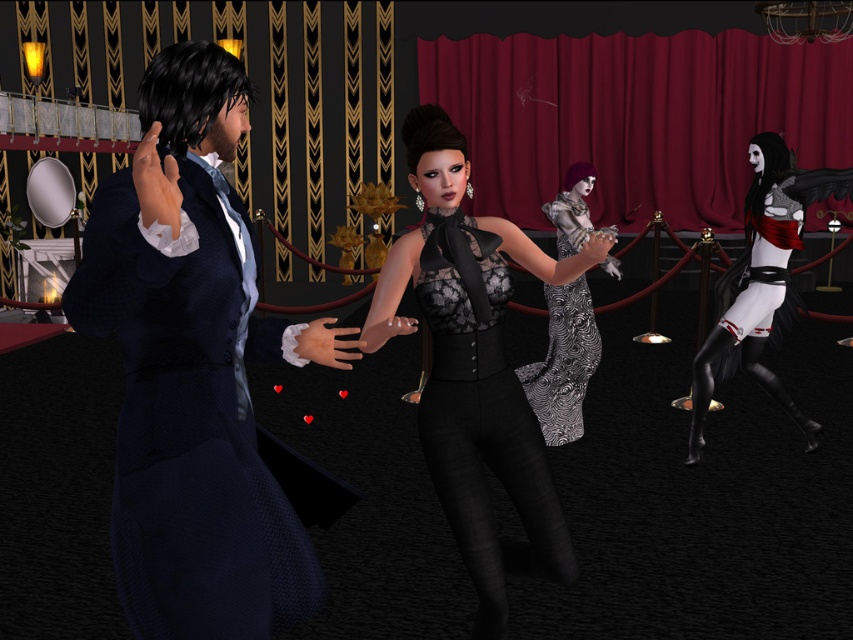
You are a photographer at the event and want to capture a closeup of the velvet blue suit at left. Which coordinate should you focus on?

You should focus on point (194, 369) to capture the velvet blue suit at left.

You are at a virtual event and want to take a photo of both the velvet blue suit at left and the white matte dress at right. Which one should you focus on first to ensure both are in frame?

The velvet blue suit at left is in front of the white matte dress at right, so focus on the velvet blue suit at left first to ensure both are in frame.